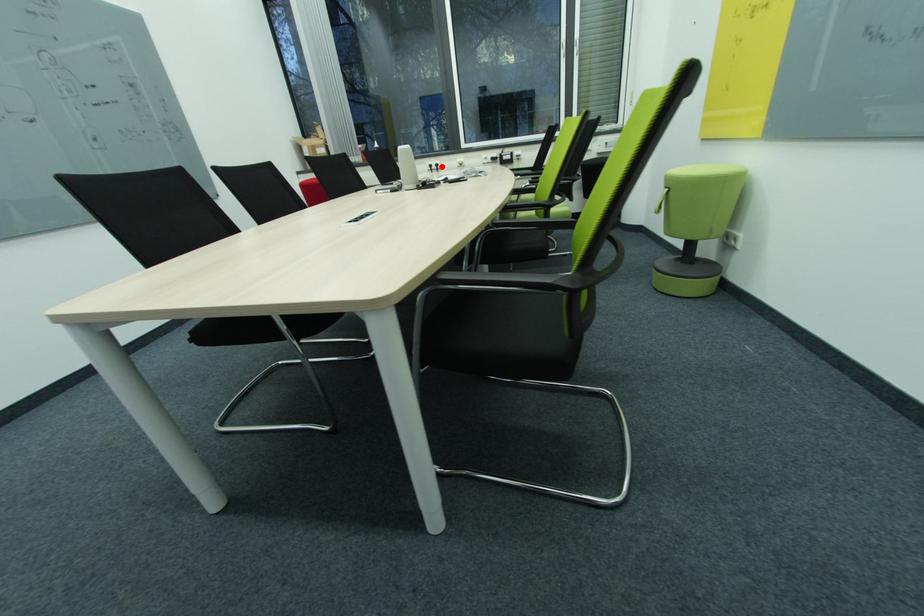
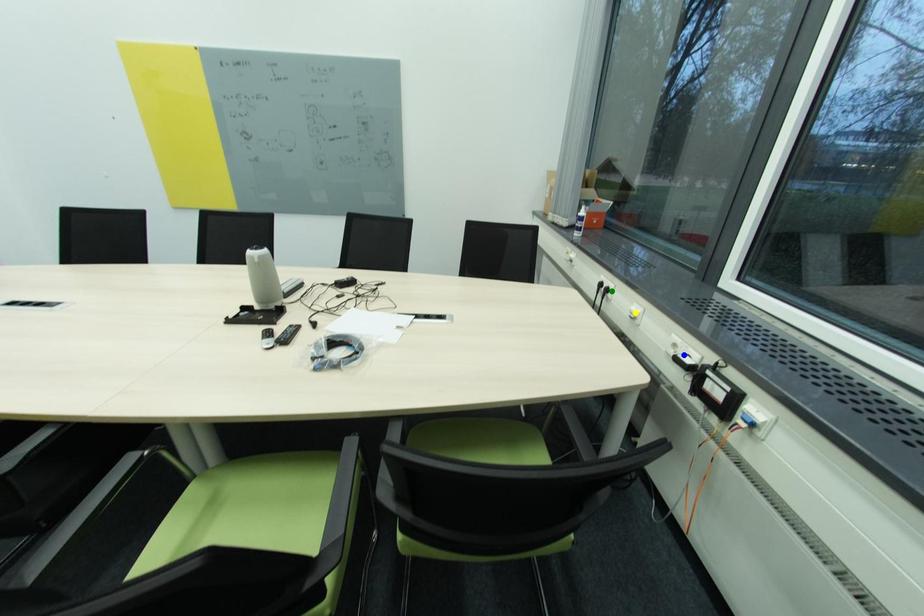
Question: I am providing you with two images of the same scene from different viewpoints. A red point is marked on the first image. You are given multiple points on the second image. Which mark in image 2 goes with the point in image 1?

Choices:
 (A) green point
 (B) yellow point
 (C) blue point

Answer: (A)